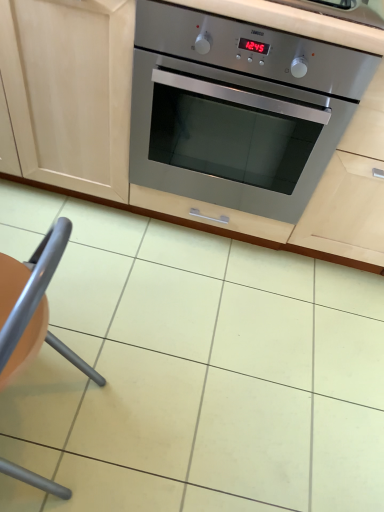
Measure the distance between point (78, 62) and camera.

Point (78, 62) and camera are 1.18 meters apart from each other.

Describe the element at coordinates (128, 135) in the screenshot. I see `stainless steel oven at center` at that location.

Where is `stainless steel oven at center`? This screenshot has height=512, width=384. stainless steel oven at center is located at coordinates (128, 135).

Describe the element at coordinates (27, 293) in the screenshot. I see `orange plastic chair at lower left` at that location.

Locate an element on the screen. The width and height of the screenshot is (384, 512). orange plastic chair at lower left is located at coordinates (27, 293).

Measure the distance between orange plastic chair at lower left and camera.

The distance of orange plastic chair at lower left from camera is 53.84 centimeters.

The width and height of the screenshot is (384, 512). What are the coordinates of `stainless steel oven at center` in the screenshot? It's located at (128, 135).

Which is more to the right, orange plastic chair at lower left or stainless steel oven at center?

stainless steel oven at center is more to the right.

Which object is closer to the camera, orange plastic chair at lower left or stainless steel oven at center?

orange plastic chair at lower left is in front.

Is point (41, 245) behind point (28, 175)?

No.

From the image's perspective, is orange plastic chair at lower left located above stainless steel oven at center?

No, from the image's perspective, orange plastic chair at lower left is not above stainless steel oven at center.

In the scene shown: From a real-world perspective, is orange plastic chair at lower left on stainless steel oven at center?

No, from a real-world perspective, orange plastic chair at lower left is not above stainless steel oven at center.

From the picture: Does orange plastic chair at lower left have a lesser width compared to stainless steel oven at center?

Yes, orange plastic chair at lower left is thinner than stainless steel oven at center.

Between orange plastic chair at lower left and stainless steel oven at center, which one has less height?

orange plastic chair at lower left.

Looking at this image, is orange plastic chair at lower left bigger or smaller than stainless steel oven at center?

Clearly, orange plastic chair at lower left is smaller in size than stainless steel oven at center.

Would you say orange plastic chair at lower left contains stainless steel oven at center?

No.

Is orange plastic chair at lower left directly adjacent to stainless steel oven at center?

No, orange plastic chair at lower left is not in contact with stainless steel oven at center.

Is orange plastic chair at lower left oriented towards stainless steel oven at center?

No, orange plastic chair at lower left is not turned towards stainless steel oven at center.

What's the angular difference between orange plastic chair at lower left and stainless steel oven at center's facing directions?

91.1 degrees separate the facing orientations of orange plastic chair at lower left and stainless steel oven at center.

Measure the distance from orange plastic chair at lower left to stainless steel oven at center.

orange plastic chair at lower left and stainless steel oven at center are 29.97 inches apart from each other.

Locate an element on the screen. cabinetry that is above the orange plastic chair at lower left (from a real-world perspective) is located at coordinates (128, 135).

Which is more to the left, stainless steel oven at center or orange plastic chair at lower left?

From the viewer's perspective, orange plastic chair at lower left appears more on the left side.

Relative to orange plastic chair at lower left, is stainless steel oven at center in front or behind?

Visually, stainless steel oven at center is located behind orange plastic chair at lower left.

Does point (120, 115) come farther from viewer compared to point (52, 259)?

Yes.

From the image's perspective, does stainless steel oven at center appear higher than orange plastic chair at lower left?

Yes.

From a real-world perspective, which object stands above the other?

From a 3D spatial view, stainless steel oven at center is above.

Considering the relative sizes of stainless steel oven at center and orange plastic chair at lower left in the image provided, is stainless steel oven at center thinner than orange plastic chair at lower left?

No.

Between stainless steel oven at center and orange plastic chair at lower left, which one has less height?

orange plastic chair at lower left.

Considering the relative sizes of stainless steel oven at center and orange plastic chair at lower left in the image provided, is stainless steel oven at center smaller than orange plastic chair at lower left?

No.

Choose the correct answer: Is stainless steel oven at center inside orange plastic chair at lower left or outside it?

stainless steel oven at center lies outside orange plastic chair at lower left.

Is stainless steel oven at center directly adjacent to orange plastic chair at lower left?

No, stainless steel oven at center is not beside orange plastic chair at lower left.

Is stainless steel oven at center turned away from orange plastic chair at lower left?

Absolutely, stainless steel oven at center is directed away from orange plastic chair at lower left.

Where is `cabinetry on the right of the orange plastic chair at lower left`? The image size is (384, 512). cabinetry on the right of the orange plastic chair at lower left is located at coordinates (128, 135).

Locate an element on the screen. cabinetry above the orange plastic chair at lower left (from the image's perspective) is located at coordinates click(128, 135).

Where is `cabinetry that is above the orange plastic chair at lower left (from a real-world perspective)`? cabinetry that is above the orange plastic chair at lower left (from a real-world perspective) is located at coordinates (128, 135).